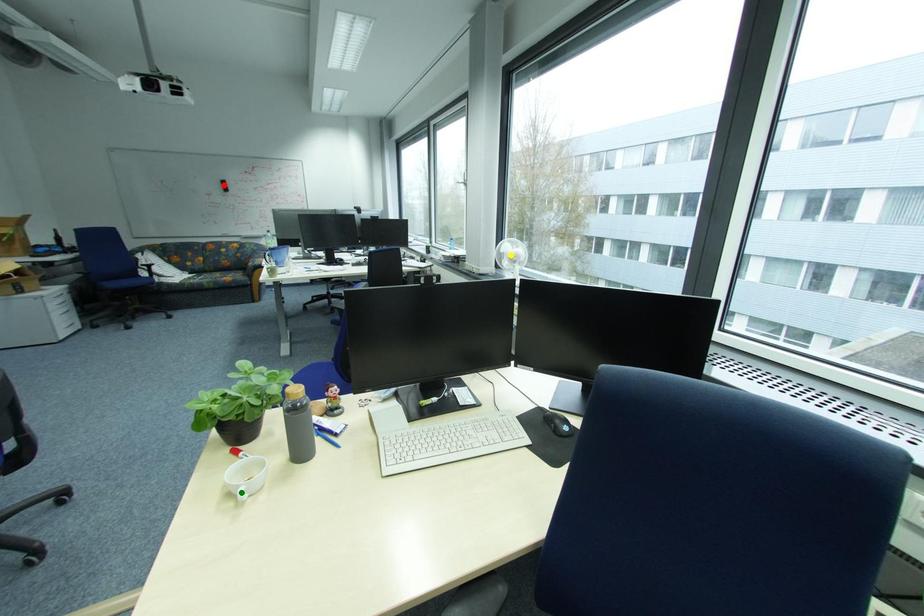
Order these from nearest to farthest:
1. yellow point
2. green point
3. red point

green point < yellow point < red point